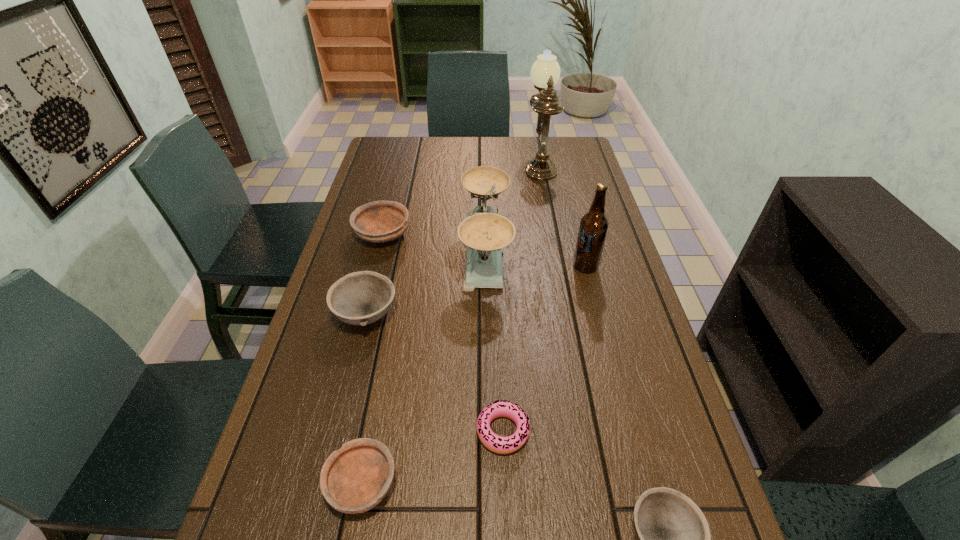
Identify the location of vacant space at the far right corner. The height and width of the screenshot is (540, 960). (575, 163).

You are a GUI agent. You are given a task and a screenshot of the screen. Output one action in this format:
    pyautogui.click(x=<x>, y=<y>)
    Task: Click on the unoccupied position between the second tallest object and the tallest object
    The image size is (960, 540).
    Given the screenshot: What is the action you would take?
    pyautogui.click(x=563, y=214)

Where is `unoccupied position between the scale and the second shortest object`? The height and width of the screenshot is (540, 960). unoccupied position between the scale and the second shortest object is located at coordinates pyautogui.click(x=424, y=368).

Locate an element on the screen. This screenshot has width=960, height=540. unoccupied position between the shortest bowl and the scale is located at coordinates (424, 368).

You are a GUI agent. You are given a task and a screenshot of the screen. Output one action in this format:
    pyautogui.click(x=<x>, y=<y>)
    Task: Click on the vacant area that lies between the shortest bowl and the doughnut
    
    Given the screenshot: What is the action you would take?
    pyautogui.click(x=433, y=457)

Where is `free spot between the farthest object and the second tallest object`? The height and width of the screenshot is (540, 960). free spot between the farthest object and the second tallest object is located at coordinates (563, 214).

The image size is (960, 540). In order to click on free space that is in between the beer bottle and the doughnut in this screenshot , I will do `click(544, 349)`.

Choose which object is the fifth nearest neighbor to the nearer brown bowl. Please provide its 2D coordinates. Your answer should be formatted as a tuple, i.e. [(x, y)], where the tuple contains the x and y coordinates of a point satisfying the conditions above.

[(380, 221)]

Locate which object is the fifth closest to the sixth shortest object. Please provide its 2D coordinates. Your answer should be formatted as a tuple, i.e. [(x, y)], where the tuple contains the x and y coordinates of a point satisfying the conditions above.

[(502, 445)]

The width and height of the screenshot is (960, 540). I want to click on the third closest bowl to the farther brown bowl, so click(674, 538).